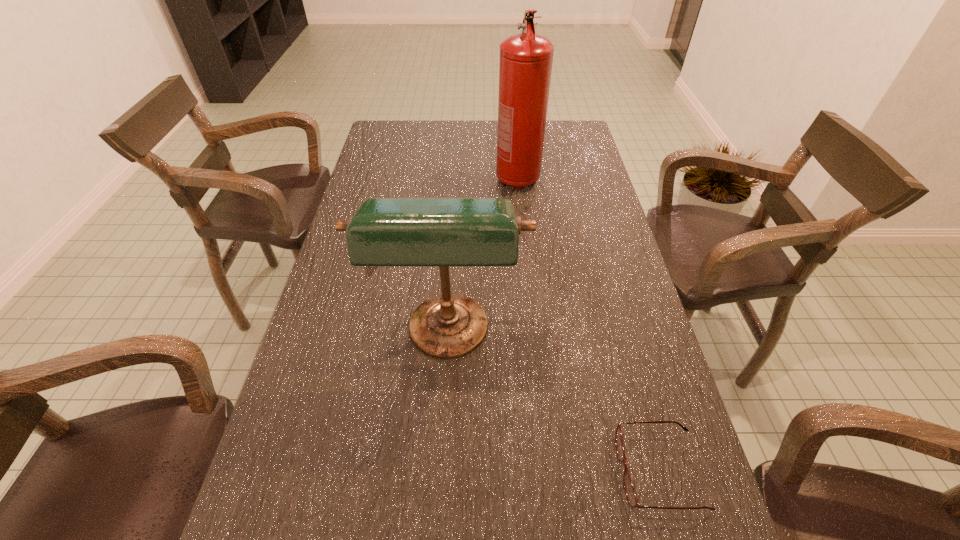
This screenshot has width=960, height=540. I want to click on the closest object to the second farthest object, so click(630, 492).

At what (x,y) coordinates should I click in order to perform the action: click on object that can be found as the closest to the nearest object. Please return your answer as a coordinate pair (x, y). This screenshot has height=540, width=960. Looking at the image, I should click on (443, 232).